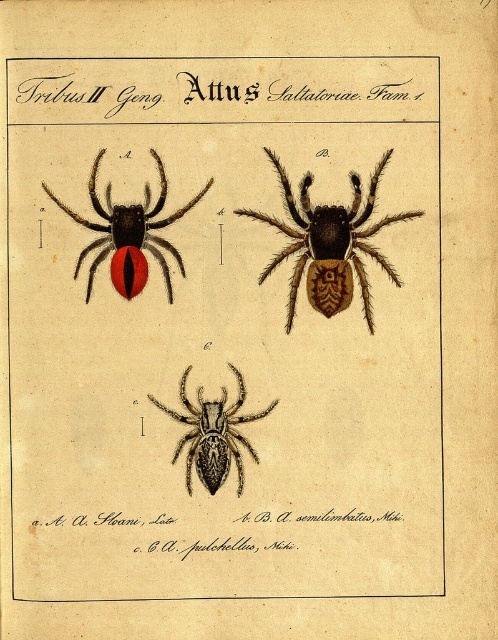
Is brown textured spider at upper center further to camera compared to matte black spider at upper left?

Yes, brown textured spider at upper center is behind matte black spider at upper left.

The width and height of the screenshot is (498, 640). What are the coordinates of `brown textured spider at upper center` in the screenshot? It's located at (330, 244).

Does point (127, 212) come in front of point (197, 420)?

Yes, point (127, 212) is in front of point (197, 420).

Is point (164, 244) farther from camera compared to point (153, 403)?

That is True.

Between point (75, 268) and point (226, 468), which one is positioned behind?

The point (75, 268) is more distant.

Find the location of a particular element. matte black spider at upper left is located at coordinates (128, 234).

Which is behind, point (342, 248) or point (234, 440)?

Positioned behind is point (342, 248).

Locate an element on the screen. This screenshot has height=640, width=498. brown textured spider at upper center is located at coordinates (330, 244).

At what (x,y) coordinates should I click in order to perform the action: click on brown textured spider at upper center. Please return your answer as a coordinate pair (x, y). Looking at the image, I should click on pos(330,244).